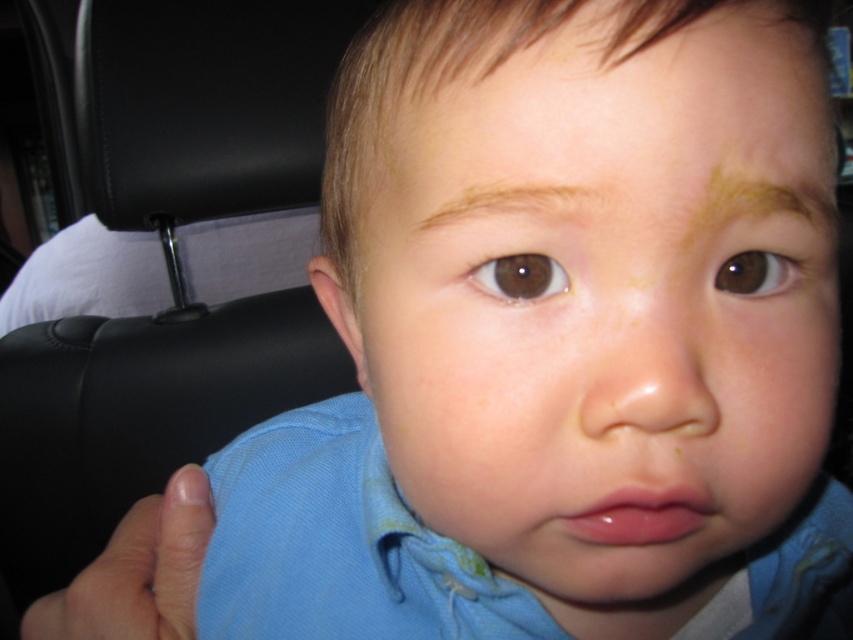
You are a photographer adjusting the focus of your camera. You need to ensure that both points, point (552,65) and point (703,202), are in focus. Which point should you focus on first to ensure the other is also in focus?

Since point (552,65) is closer to the camera than point (703,202), you should focus on point (552,65) first. This ensures that the depth of field will extend from the closer point to the farther one, keeping both in focus.

You are a photographer taking a close up photo of a child in a car seat. You notice the light brown skin at upper center and the brown matte eye at center. Which one is closer to the camera?

The light brown skin at upper center is closer to the camera than the brown matte eye at center because it is in front of it.

Looking at the image of the child in the car seat, can you tell me which of the two eyebrows, the brown matte eyebrow at upper right or the brown smooth eyebrow at upper center, is bigger in size?

The brown matte eyebrow at upper right is larger in size than the brown smooth eyebrow at upper center.